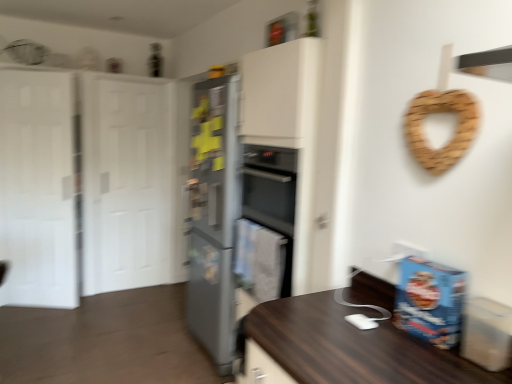
Question: Should I look upward or downward to see satin silver refrigerator at center?

Choices:
 (A) up
 (B) down

Answer: (B)

Question: Considering the relative sizes of white glossy door at left, which ranks as the 2th glass door in back-to-front order, and white matte door at left in the image provided, is white glossy door at left, which ranks as the 2th glass door in back-to-front order, bigger than white matte door at left?

Choices:
 (A) no
 (B) yes

Answer: (A)

Question: From the image's perspective, is white glossy door at left, arranged as the 2th glass door when viewed from the right, over white matte door at left?

Choices:
 (A) no
 (B) yes

Answer: (A)

Question: Can you confirm if white glossy door at left, which ranks as the 2th glass door in back-to-front order, is thinner than white matte door at left?

Choices:
 (A) no
 (B) yes

Answer: (B)

Question: Can you confirm if white glossy door at left, acting as the 1th glass door starting from the front, is positioned to the right of white matte door at left?

Choices:
 (A) yes
 (B) no

Answer: (B)

Question: Considering the relative sizes of white glossy door at left, the 1th glass door in the left-to-right sequence, and white matte door at left in the image provided, is white glossy door at left, the 1th glass door in the left-to-right sequence, shorter than white matte door at left?

Choices:
 (A) no
 (B) yes

Answer: (B)

Question: From a real-world perspective, is white glossy door at left, the 1th glass door in the left-to-right sequence, over white matte door at left?

Choices:
 (A) no
 (B) yes

Answer: (A)

Question: Does white matte door at left have a greater width compared to satin silver refrigerator at center?

Choices:
 (A) yes
 (B) no

Answer: (B)

Question: Can you confirm if white matte door at left is positioned to the right of satin silver refrigerator at center?

Choices:
 (A) no
 (B) yes

Answer: (A)

Question: Considering the relative sizes of white matte door at left and satin silver refrigerator at center in the image provided, is white matte door at left thinner than satin silver refrigerator at center?

Choices:
 (A) no
 (B) yes

Answer: (B)

Question: Is white matte door at left facing towards satin silver refrigerator at center?

Choices:
 (A) yes
 (B) no

Answer: (A)

Question: From a real-world perspective, is white matte door at left beneath satin silver refrigerator at center?

Choices:
 (A) no
 (B) yes

Answer: (A)

Question: Is satin silver refrigerator at center at the back of white matte door at left?

Choices:
 (A) no
 (B) yes

Answer: (A)

Question: Is satin silver refrigerator at center thinner than white glossy door at left, which ranks as the 2th glass door in front-to-back order?

Choices:
 (A) no
 (B) yes

Answer: (A)